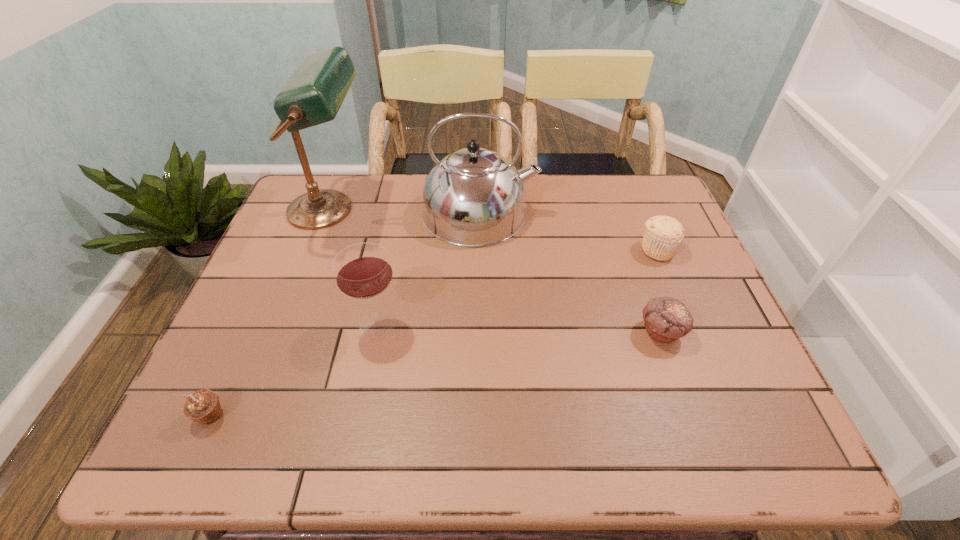
You are a GUI agent. You are given a task and a screenshot of the screen. Output one action in this format:
    pyautogui.click(x=<x>, y=<y>)
    Task: Click on the tallest object
    
    Given the screenshot: What is the action you would take?
    pyautogui.click(x=314, y=93)

Where is `the fourth object from left to right`? This screenshot has width=960, height=540. the fourth object from left to right is located at coordinates (473, 197).

I want to click on kettle, so click(473, 197).

Locate an element on the screen. This screenshot has width=960, height=540. the fourth shortest object is located at coordinates (363, 271).

Locate an element on the screen. This screenshot has width=960, height=540. wineglass is located at coordinates (363, 271).

You are a GUI agent. You are given a task and a screenshot of the screen. Output one action in this format:
    pyautogui.click(x=<x>, y=<y>)
    Task: Click on the farthest muffin
    The height and width of the screenshot is (540, 960).
    Given the screenshot: What is the action you would take?
    pyautogui.click(x=663, y=235)

Find the location of a particular element. the second nearest muffin is located at coordinates (666, 319).

Identify the location of the nearest object. The image size is (960, 540). (203, 406).

You are a GUI agent. You are given a task and a screenshot of the screen. Output one action in this format:
    pyautogui.click(x=<x>, y=<y>)
    Task: Click on the nearest muffin
    This screenshot has width=960, height=540.
    Given the screenshot: What is the action you would take?
    pyautogui.click(x=203, y=406)

The height and width of the screenshot is (540, 960). I want to click on blank space located above the green lampshade of the tallest object, so click(x=489, y=210).